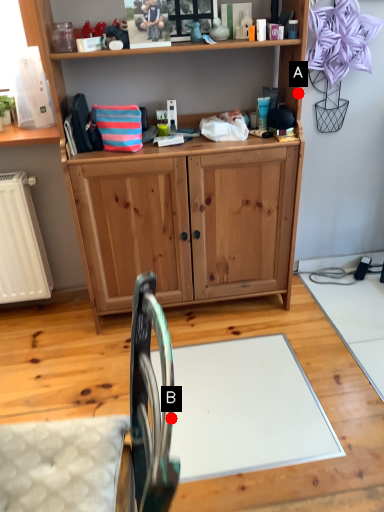
Question: Two points are circled on the image, labeled by A and B beside each circle. Among these points, which one is farthest from the camera?

Choices:
 (A) A is further
 (B) B is further

Answer: (A)